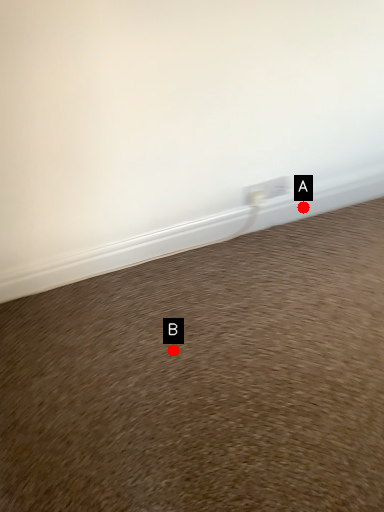
Question: Two points are circled on the image, labeled by A and B beside each circle. Which point appears farthest from the camera in this image?

Choices:
 (A) A is further
 (B) B is further

Answer: (A)